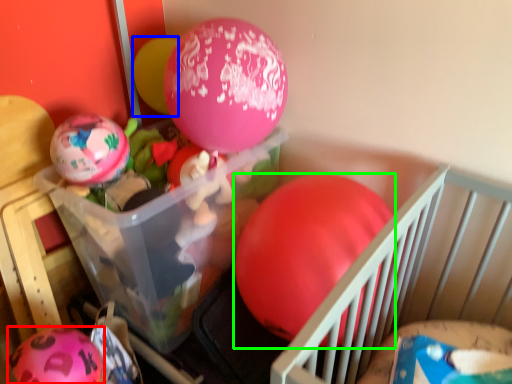
Question: Which object is positioned closest to balloon (highlighted by a red box)? Select from balloon (highlighted by a blue box) and balloon (highlighted by a green box).

Choices:
 (A) balloon
 (B) balloon

Answer: (B)